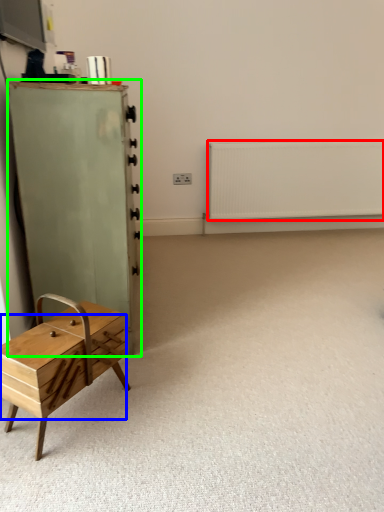
Question: Which object is positioned farthest from radiator (highlighted by a red box)? Select from drawer (highlighted by a blue box) and chest of drawers (highlighted by a green box).

Choices:
 (A) drawer
 (B) chest of drawers

Answer: (A)